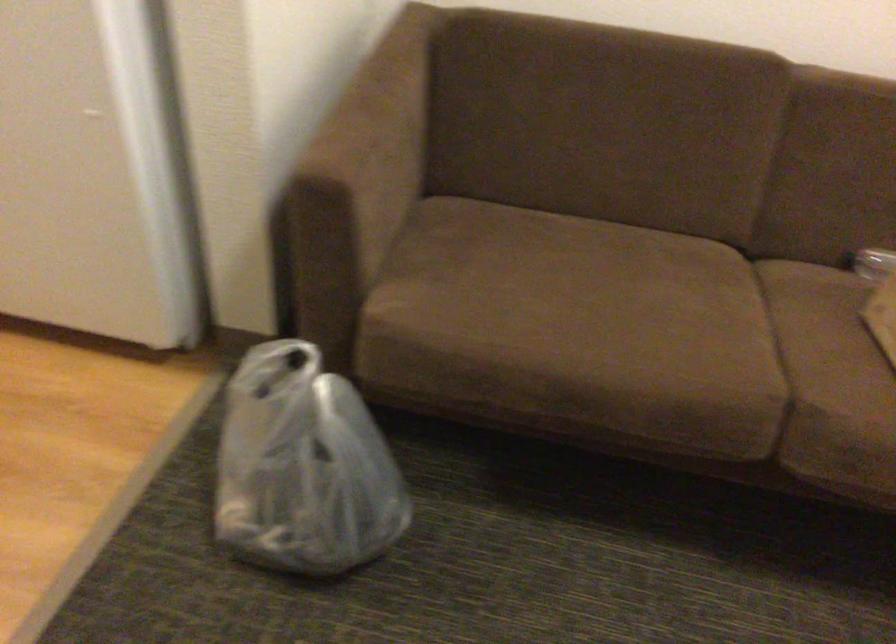
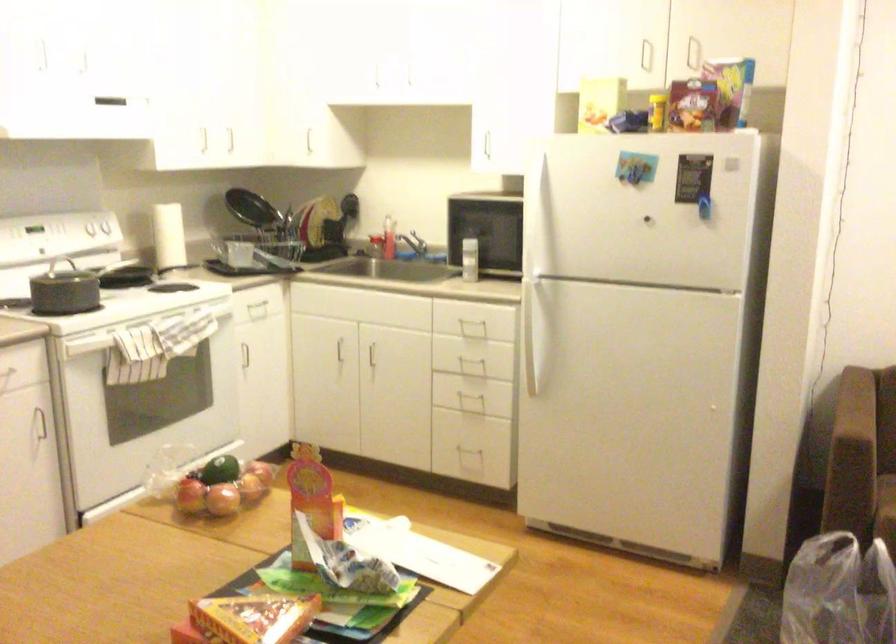
The point at (339, 201) is marked in the first image. Where is the corresponding point in the second image?

(879, 446)